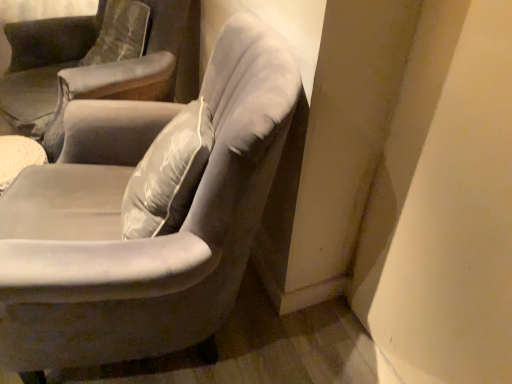
Question: In terms of height, does velvet gray armchair at upper left, which appears as the second chair when viewed from the front, look taller or shorter compared to velvet gray armchair at center, placed as the first chair when sorted from front to back?

Choices:
 (A) tall
 (B) short

Answer: (B)

Question: Is velvet gray armchair at upper left, the 1th chair in the back-to-front sequence, bigger or smaller than velvet gray armchair at center, the second chair when ordered from back to front?

Choices:
 (A) small
 (B) big

Answer: (B)

Question: Is velvet gray armchair at upper left, the 1th chair in the back-to-front sequence, inside or outside of velvet gray armchair at center, the second chair when ordered from back to front?

Choices:
 (A) inside
 (B) outside

Answer: (B)

Question: Based on their sizes in the image, would you say velvet gray armchair at center, the second chair when ordered from back to front, is bigger or smaller than velvet gray armchair at upper left, which appears as the second chair when viewed from the front?

Choices:
 (A) small
 (B) big

Answer: (A)

Question: From the image's perspective, is velvet gray armchair at center, the second chair when ordered from back to front, located above or below velvet gray armchair at upper left, which appears as the second chair when viewed from the front?

Choices:
 (A) below
 (B) above

Answer: (A)

Question: Relative to velvet gray armchair at upper left, the 1th chair in the back-to-front sequence, is velvet gray armchair at center, the second chair when ordered from back to front, in front or behind?

Choices:
 (A) front
 (B) behind

Answer: (A)

Question: Is point (252, 175) closer or farther from the camera than point (31, 79)?

Choices:
 (A) farther
 (B) closer

Answer: (B)